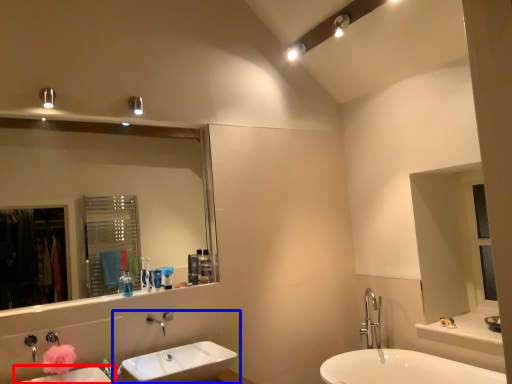
Question: Which point is further to the camera, sink (highlighted by a red box) or sink (highlighted by a blue box)?

Choices:
 (A) sink
 (B) sink

Answer: (B)